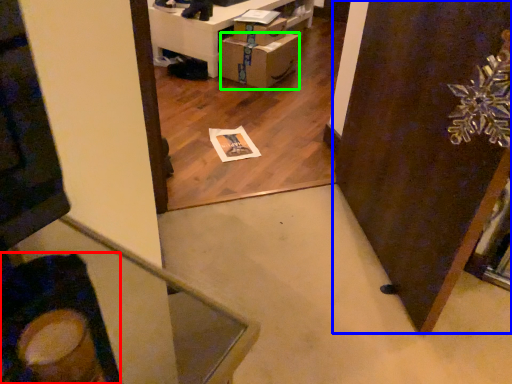
Question: Estimate the real-world distances between objects in this image. Which object is closer to swivel chair (highlighted by a red box), door (highlighted by a blue box) or cardboard box (highlighted by a green box)?

Choices:
 (A) door
 (B) cardboard box

Answer: (A)